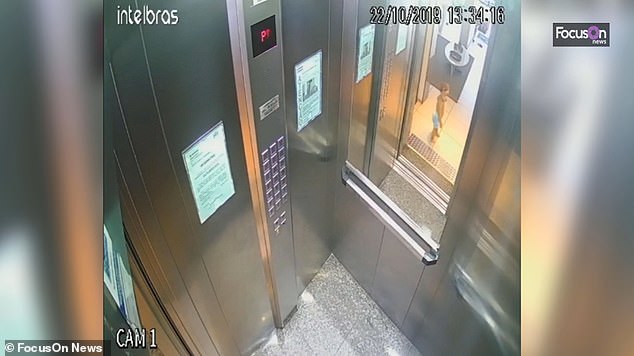
Where is `lobby`? lobby is located at coordinates (442, 149).